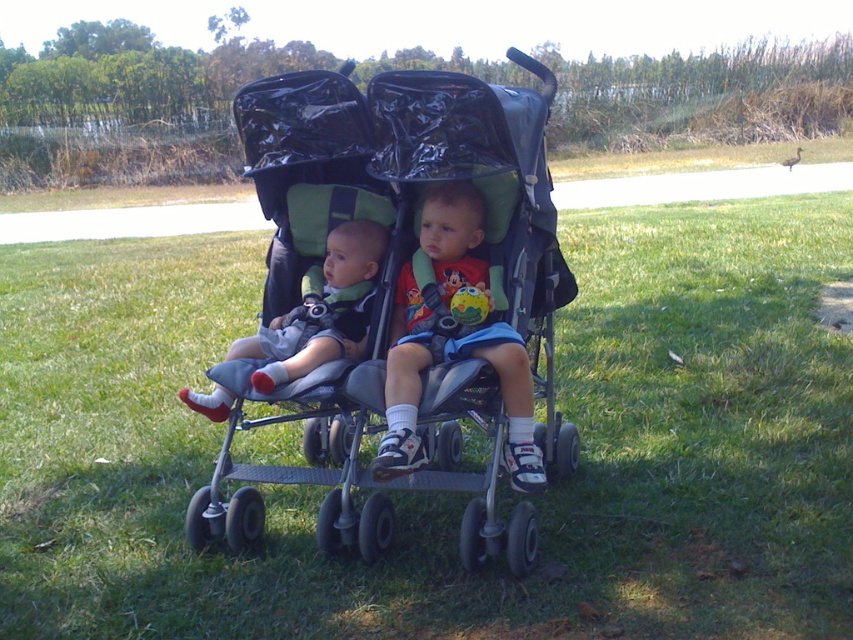
Question: Which of these objects is positioned farthest from the matte gray stroller at left?

Choices:
 (A) black plastic stroller at center
 (B) green grass at center
 (C) matte green cushion at center

Answer: (B)

Question: Based on their relative distances, which object is nearer to the green grass at center?

Choices:
 (A) matte green cushion at center
 (B) black plastic stroller at center
 (C) matte gray stroller at left

Answer: (C)

Question: Can you confirm if green grass at center is smaller than matte gray stroller at left?

Choices:
 (A) yes
 (B) no

Answer: (A)

Question: Can you confirm if green grass at center is bigger than matte green cushion at center?

Choices:
 (A) no
 (B) yes

Answer: (A)

Question: Considering the real-world distances, which object is closest to the black plastic stroller at center?

Choices:
 (A) matte green cushion at center
 (B) matte gray stroller at left

Answer: (A)

Question: Is green grass at center bigger than matte green cushion at center?

Choices:
 (A) no
 (B) yes

Answer: (A)